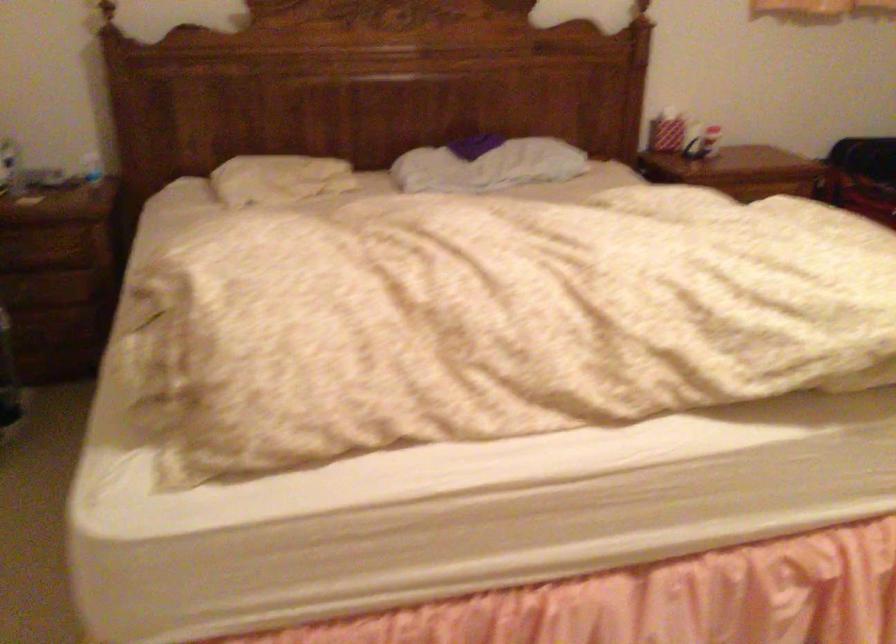
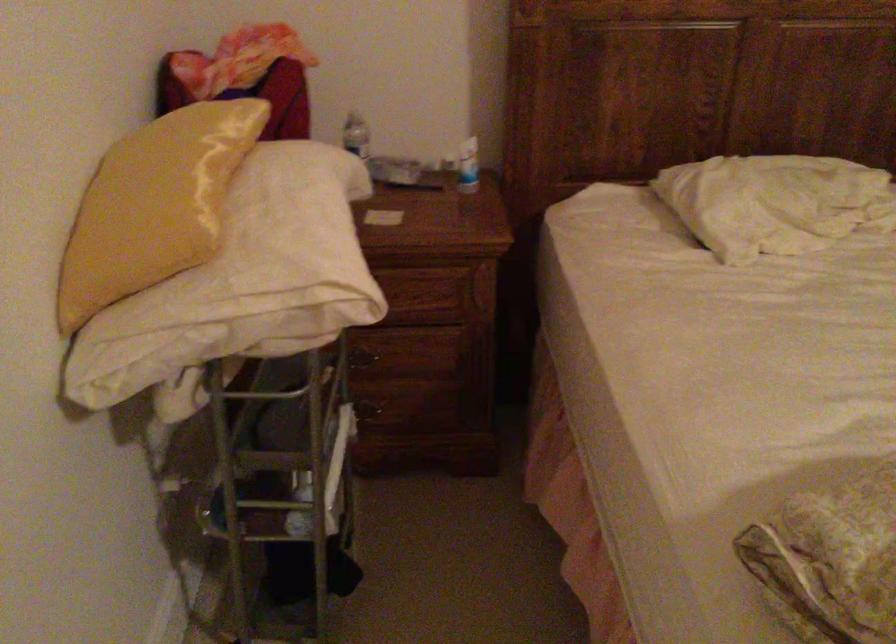
What movement of the cameraman would produce the second image?

The cameraman walked toward left, forward.